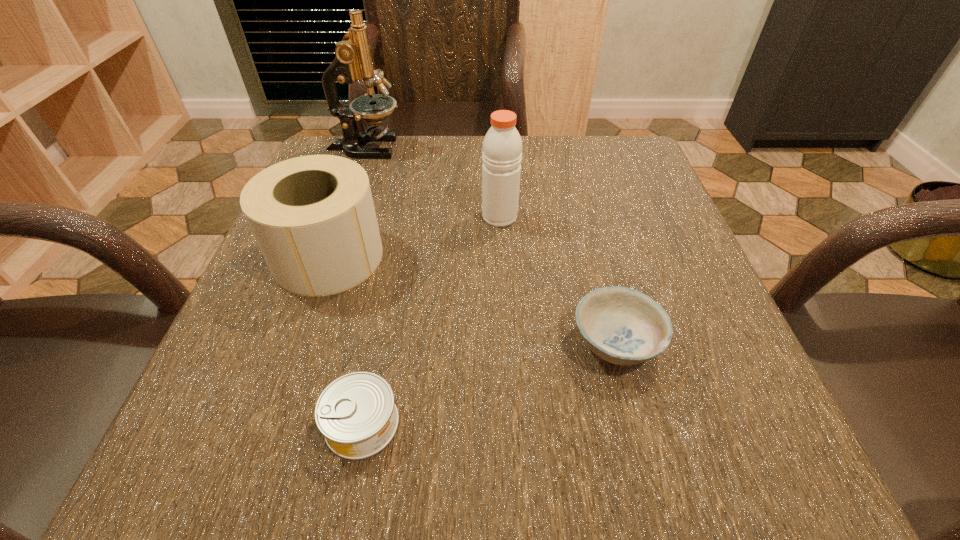
I want to click on vacant space located on the back of the toilet tissue, so click(x=360, y=166).

The image size is (960, 540). I want to click on vacant region located on the right of the fourth farthest object, so click(721, 342).

This screenshot has width=960, height=540. I want to click on vacant space located on the left of the nearest object, so click(209, 423).

Find the location of a particular element. This screenshot has width=960, height=540. object situated at the far edge is located at coordinates (353, 61).

Identify the location of object that is at the near edge. (356, 413).

The height and width of the screenshot is (540, 960). Identify the location of microscope located at the left edge. (353, 61).

Identify the location of toilet tissue located at the left edge. (313, 217).

Locate an element on the screen. This screenshot has height=540, width=960. object located in the right edge section of the desktop is located at coordinates (623, 326).

The width and height of the screenshot is (960, 540). Find the location of `object that is positioned at the far left corner`. object that is positioned at the far left corner is located at coordinates (353, 61).

In the image, there is a desktop. Where is `vacant space at the far edge`? Image resolution: width=960 pixels, height=540 pixels. vacant space at the far edge is located at coordinates (555, 181).